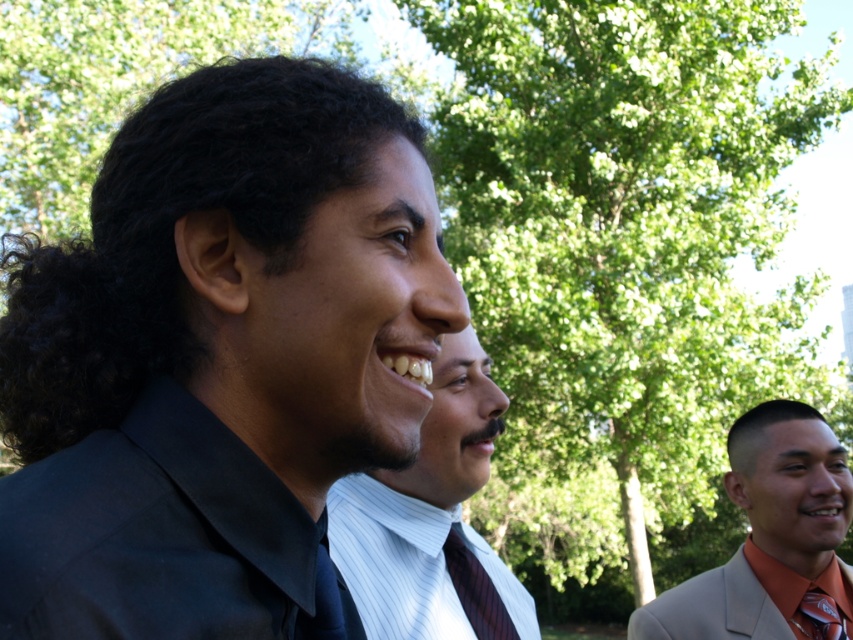
Consider the image. Is white pinstripe shirt and tie at center shorter than striped fabric tie at center?

No, white pinstripe shirt and tie at center is not shorter than striped fabric tie at center.

Is the position of white pinstripe shirt and tie at center less distant than that of striped fabric tie at center?

Yes, white pinstripe shirt and tie at center is in front of striped fabric tie at center.

Between point (531, 628) and point (474, 625), which one is positioned in front?

Point (474, 625) is in front.

At what (x,y) coordinates should I click in order to perform the action: click on white pinstripe shirt and tie at center. Please return your answer as a coordinate pair (x, y). The height and width of the screenshot is (640, 853). Looking at the image, I should click on (410, 563).

Between dark blue satin shirt at left and orange satin tie at right, which one is positioned lower?

orange satin tie at right is below.

Does dark blue satin shirt at left appear on the left side of orange satin tie at right?

Indeed, dark blue satin shirt at left is positioned on the left side of orange satin tie at right.

Between point (265, 474) and point (793, 502), which one is positioned in front?

Point (265, 474) is in front.

Find the location of `dark blue satin shirt at left`. dark blue satin shirt at left is located at coordinates (160, 536).

Does point (659, 88) come farther from viewer compared to point (750, 618)?

Yes, it is.

Does point (502, 339) come closer to viewer compared to point (827, 468)?

No, (502, 339) is further to viewer.

Where is `green leafy tree at center`? This screenshot has height=640, width=853. green leafy tree at center is located at coordinates (628, 236).